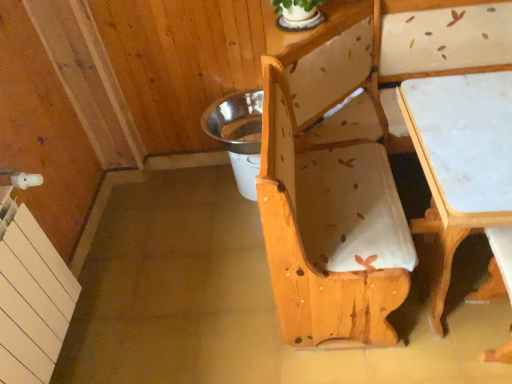
Question: Is white marble table at lower right oriented away from natural wood bench at center?

Choices:
 (A) no
 (B) yes

Answer: (B)

Question: Does white marble table at lower right come behind natural wood bench at center?

Choices:
 (A) yes
 (B) no

Answer: (A)

Question: Considering the relative sizes of white marble table at lower right and natural wood bench at center in the image provided, is white marble table at lower right taller than natural wood bench at center?

Choices:
 (A) no
 (B) yes

Answer: (A)

Question: Does white marble table at lower right have a lesser width compared to natural wood bench at center?

Choices:
 (A) yes
 (B) no

Answer: (A)

Question: Can you confirm if white marble table at lower right is bigger than natural wood bench at center?

Choices:
 (A) no
 (B) yes

Answer: (A)

Question: Would you say white marble table at lower right is outside natural wood bench at center?

Choices:
 (A) yes
 (B) no

Answer: (B)

Question: Is metallic silver potty at center completely or partially outside of natural wood bench at center?

Choices:
 (A) no
 (B) yes

Answer: (B)

Question: Considering the relative sizes of metallic silver potty at center and natural wood bench at center in the image provided, is metallic silver potty at center smaller than natural wood bench at center?

Choices:
 (A) no
 (B) yes

Answer: (B)

Question: Could you tell me if metallic silver potty at center is turned towards natural wood bench at center?

Choices:
 (A) yes
 (B) no

Answer: (B)

Question: From the image's perspective, would you say metallic silver potty at center is positioned over natural wood bench at center?

Choices:
 (A) yes
 (B) no

Answer: (A)

Question: Does metallic silver potty at center have a greater height compared to natural wood bench at center?

Choices:
 (A) yes
 (B) no

Answer: (B)

Question: Does metallic silver potty at center have a lesser width compared to natural wood bench at center?

Choices:
 (A) yes
 (B) no

Answer: (A)

Question: Can you confirm if white marble table at lower right is positioned to the right of metallic silver potty at center?

Choices:
 (A) no
 (B) yes

Answer: (B)